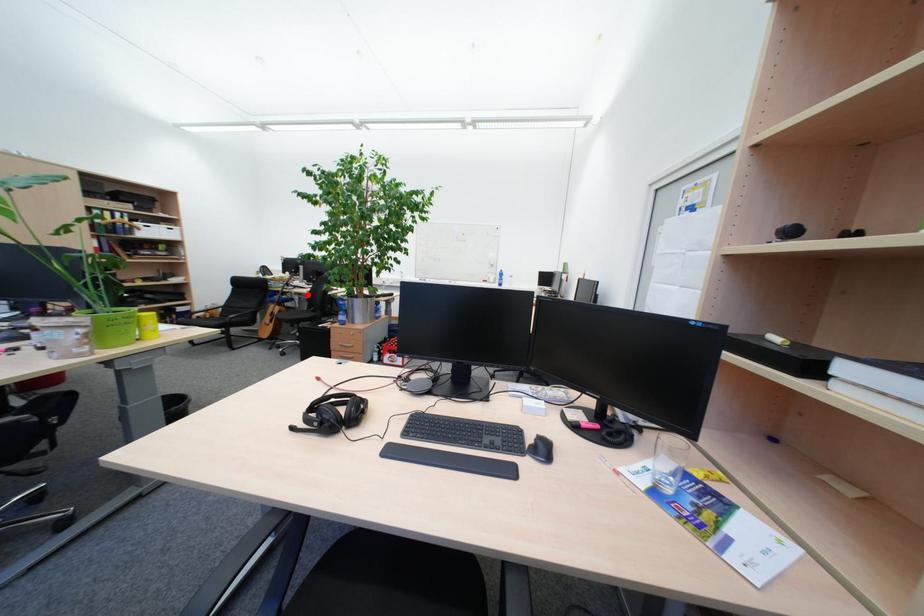
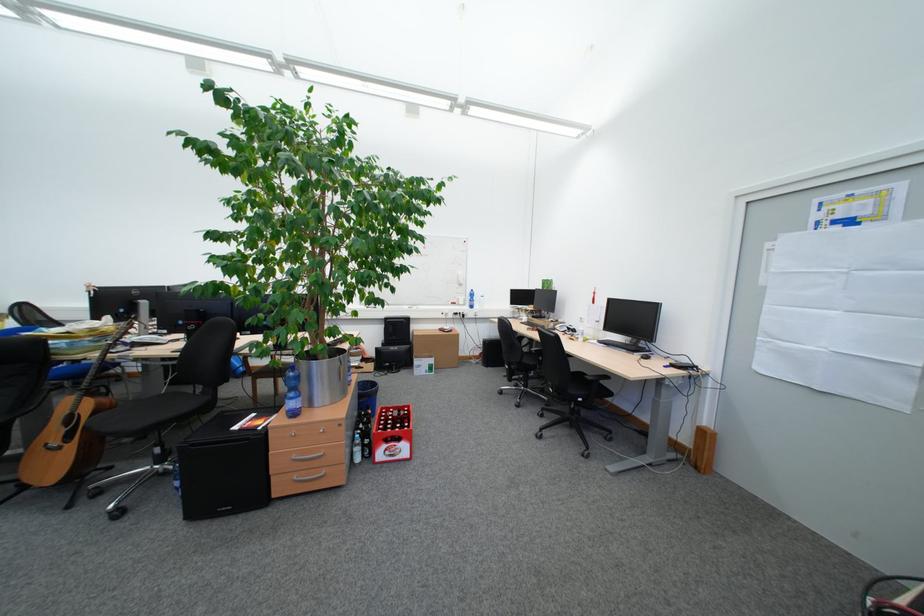
Question: I am providing you with two images of the same scene from different viewpoints. Image1 has a red point marked. In image2, the corresponding 3D location appears at what relative position? Reply with the corresponding letter.

Choices:
 (A) Closer
 (B) Farther

Answer: (A)